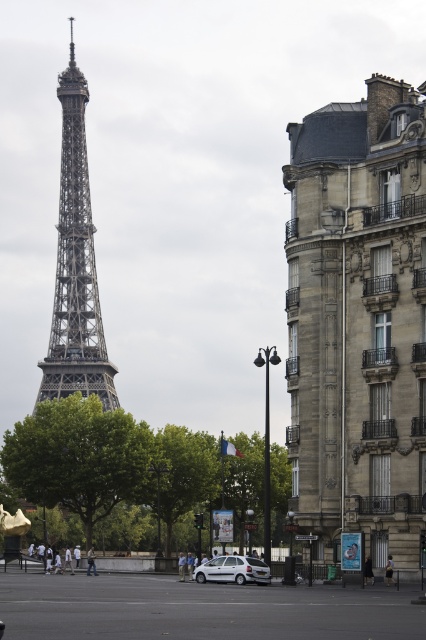
Question: Which object appears farthest from the camera in this image?

Choices:
 (A) black fabric person at lower center
 (B) white matte car at lower center
 (C) light brown leather jacket at lower center
 (D) dark gray fabric pants at center

Answer: (C)

Question: Can you confirm if metallic lattice tower at center is thinner than white cotton shirt at center?

Choices:
 (A) no
 (B) yes

Answer: (A)

Question: Is the position of metallic lattice tower at center more distant than that of light brown leather jacket at center?

Choices:
 (A) no
 (B) yes

Answer: (B)

Question: Estimate the real-world distances between objects in this image. Which object is farther from the white cotton shirt at center?

Choices:
 (A) light brown leather jacket at center
 (B) metallic lattice tower at center

Answer: (B)

Question: Is white matte car at lower center positioned before dark gray fabric pants at center?

Choices:
 (A) no
 (B) yes

Answer: (A)

Question: Which point is farther to the camera?

Choices:
 (A) (68, 557)
 (B) (259, 561)
 (C) (88, 561)
 (D) (373, 388)

Answer: (C)